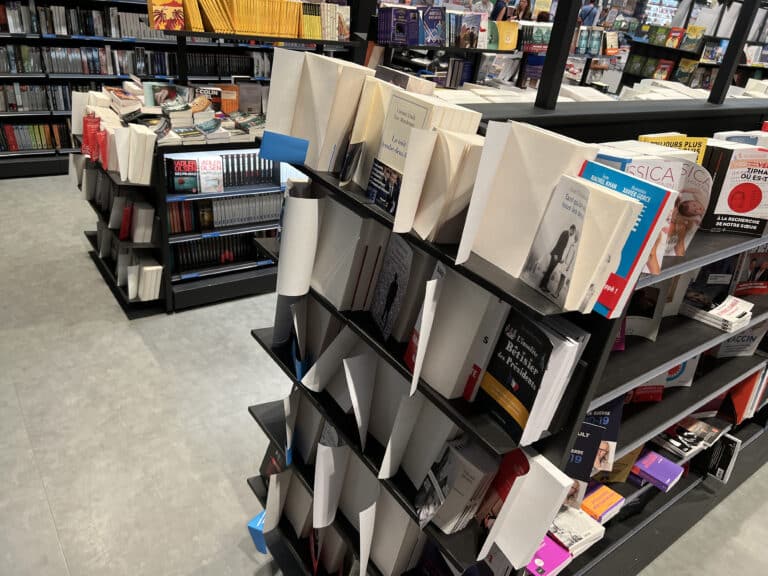
At what (x,y) coordinates should I click in order to perform the action: click on blue paper under books. Please return your answer as a coordinate pair (x, y). This screenshot has width=768, height=576. Looking at the image, I should click on (253, 533).